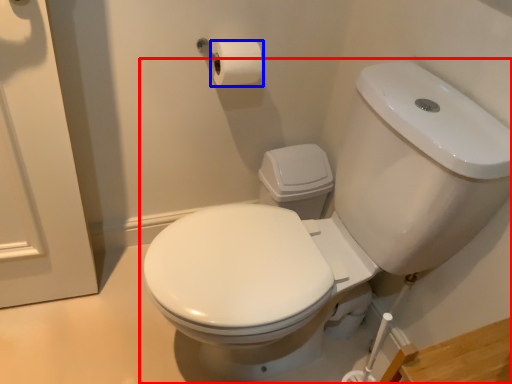
Question: Which object is closer to the camera taking this photo, toilet (highlighted by a red box) or toilet paper (highlighted by a blue box)?

Choices:
 (A) toilet
 (B) toilet paper

Answer: (A)